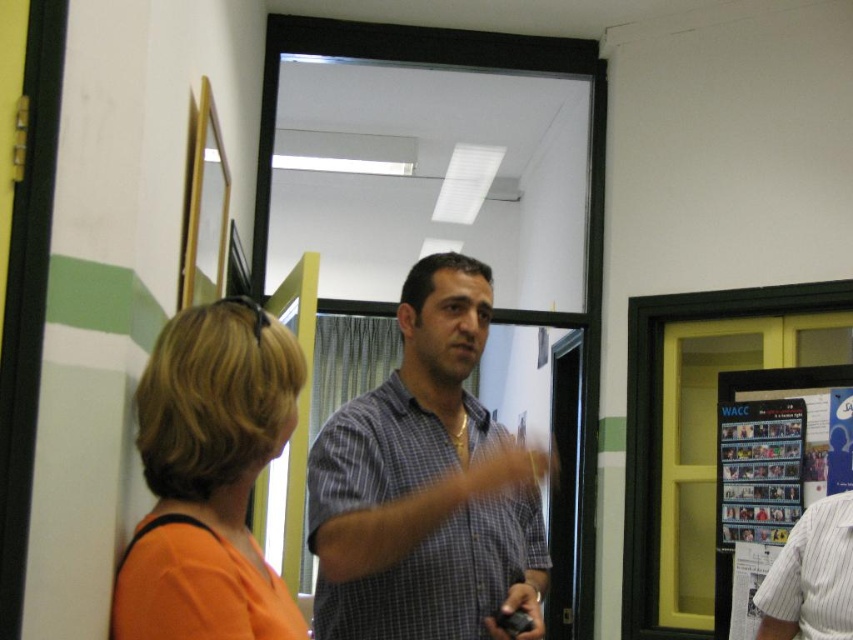
You are a security camera in the office. You need to determine if the two people wearing checkered fabric shirt at center and orange fabric shirt at left are close enough to hear each other without raising their voices. The minimum distance for comfortable conversation is 16 inches. Can they hear each other comfortably?

The checkered fabric shirt at center and orange fabric shirt at left are 15.52 inches apart, which is less than the 16 inches required for comfortable conversation. Therefore, they can hear each other comfortably without raising their voices.

You are standing in the office scene and want to know which of the two points, point (467,579) or point (518,611), is closer to you. Based on the description, which point is nearer?

Point (467,579) is further to the camera than point (518,611). Therefore, point (518,611) is closer to you.

You are a photographer setting up a wide shot for a group photo in the office scene. The checkered fabric shirt at center and the orange fabric shirt at left are both in the frame. Based on their widths, which shirt should you focus on to ensure both are fully visible in the shot?

The checkered fabric shirt at center might be wider than orange fabric shirt at left, so focusing on the checkered fabric shirt at center would ensure both are fully visible since it is likely wider and occupies more space in the frame.